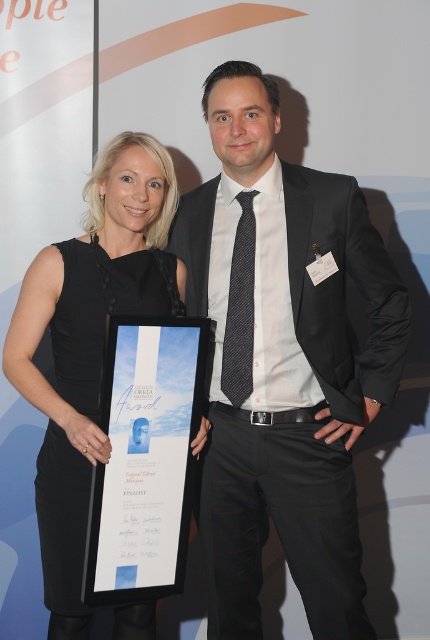
Looking at this image, does matte black suit at center appear on the right side of black satin dress at left?

Correct, you'll find matte black suit at center to the right of black satin dress at left.

Which is more to the left, matte black suit at center or black satin dress at left?

Positioned to the left is black satin dress at left.

Is point (355, 244) positioned behind point (165, 150)?

Yes, it is.

Find the location of a particular element. Image resolution: width=430 pixels, height=640 pixels. matte black suit at center is located at coordinates (282, 362).